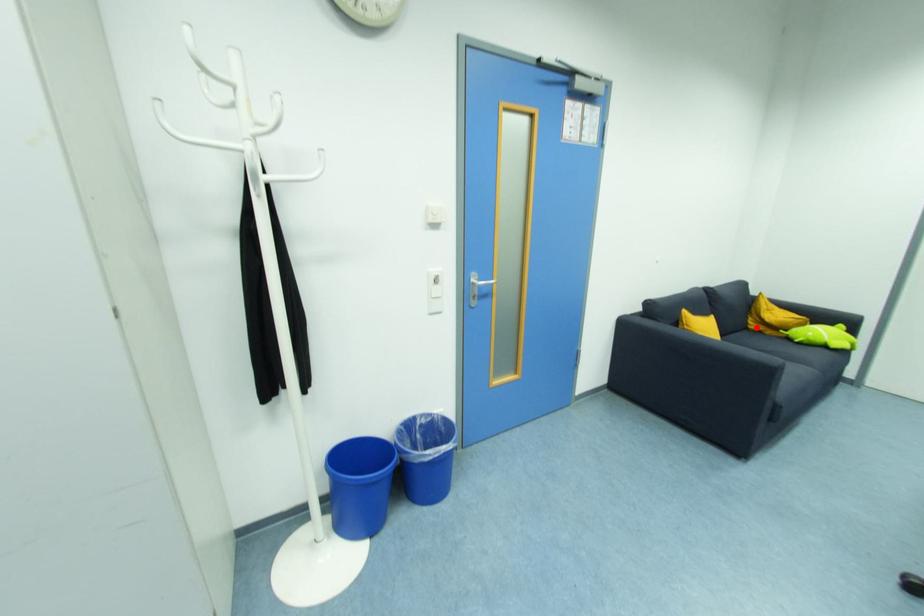
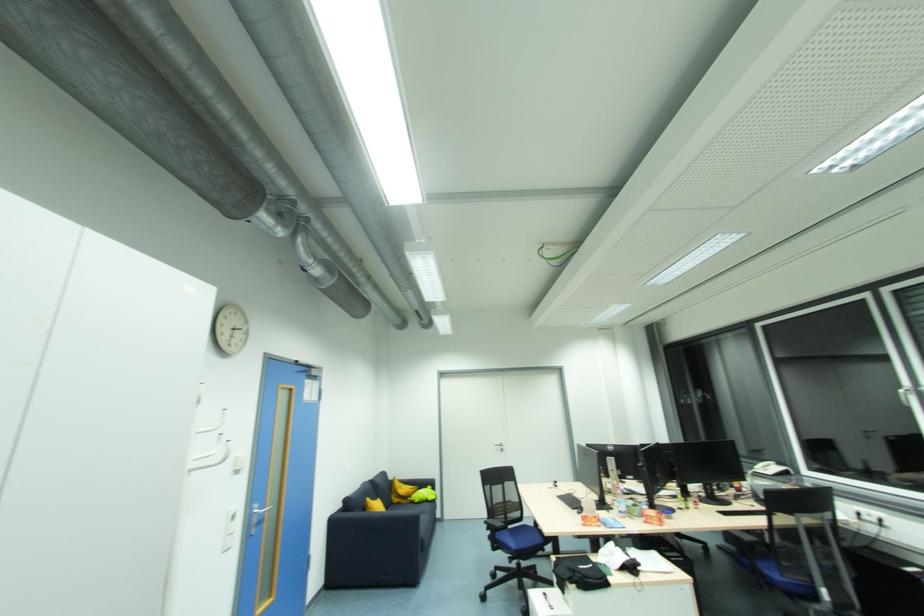
Question: I am providing you with two images of the same scene from different viewpoints. A red point is marked on the first image. Is the red point's position out of view in image 2?

Choices:
 (A) Yes
 (B) No

Answer: (B)